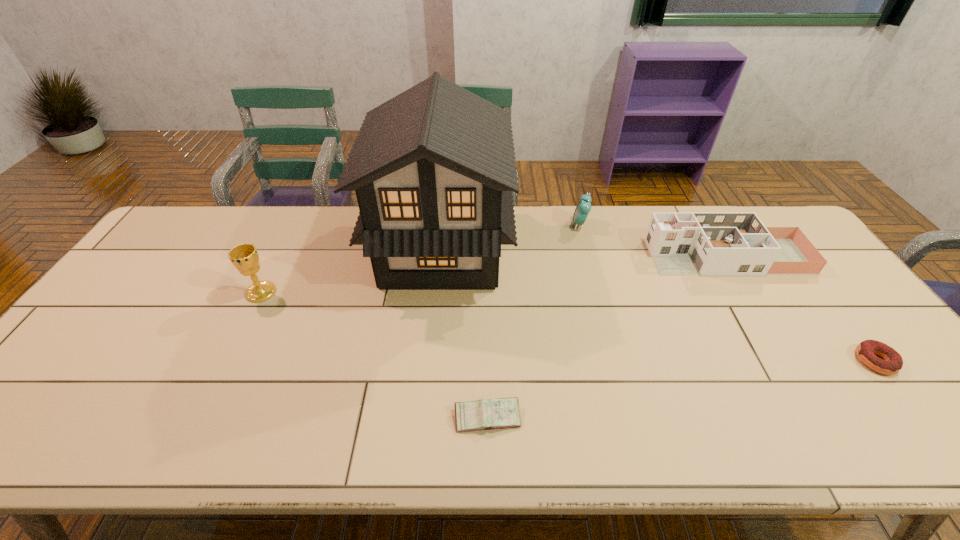
Locate an element on the screen. free location located 0.250m on the front-facing side of the left dollhouse is located at coordinates (590, 250).

Find the location of a particular element. free region located on the right of the chalice is located at coordinates (314, 293).

The height and width of the screenshot is (540, 960). Find the location of `free region located 0.060m on the face of the third object from right to left`. free region located 0.060m on the face of the third object from right to left is located at coordinates (553, 225).

Where is `vacant space situated on the face of the third object from right to left`? vacant space situated on the face of the third object from right to left is located at coordinates (541, 225).

Find the location of a particular element. free space located 0.290m on the face of the third object from right to left is located at coordinates pyautogui.click(x=486, y=225).

Where is `vacant space situated 0.070m at the front door of the right dollhouse`? The width and height of the screenshot is (960, 540). vacant space situated 0.070m at the front door of the right dollhouse is located at coordinates (629, 256).

Locate an element on the screen. This screenshot has height=540, width=960. vacant area situated 0.370m at the front door of the right dollhouse is located at coordinates (533, 256).

This screenshot has width=960, height=540. Find the location of `vacant space located at the front door of the right dollhouse`. vacant space located at the front door of the right dollhouse is located at coordinates click(540, 256).

The height and width of the screenshot is (540, 960). I want to click on vacant area situated on the left of the second shortest object, so click(x=347, y=417).

Find the location of a particular element. This screenshot has width=960, height=540. blank space located 0.310m on the left of the shortest object is located at coordinates (732, 361).